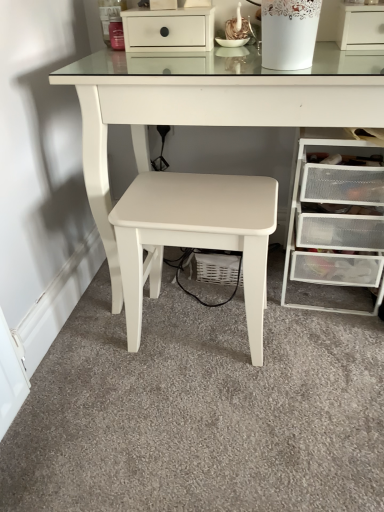
Question: Is clear plastic drawers at lower right, arranged as the first chest of drawers when ordered from the bottom, completely or partially outside of white matte drawer at upper center, positioned as the first chest of drawers in top-to-bottom order?

Choices:
 (A) yes
 (B) no

Answer: (A)

Question: Does clear plastic drawers at lower right, which appears as the 1th chest of drawers when viewed from the right, appear on the left side of white matte drawer at upper center, which ranks as the first chest of drawers in left-to-right order?

Choices:
 (A) yes
 (B) no

Answer: (B)

Question: From the image's perspective, is clear plastic drawers at lower right, which appears as the 1th chest of drawers when viewed from the right, on white matte drawer at upper center, which appears as the second chest of drawers when ordered from the bottom?

Choices:
 (A) yes
 (B) no

Answer: (B)

Question: Is clear plastic drawers at lower right, arranged as the first chest of drawers when ordered from the bottom, at the right side of white matte drawer at upper center, which ranks as the first chest of drawers in left-to-right order?

Choices:
 (A) no
 (B) yes

Answer: (B)

Question: Does clear plastic drawers at lower right, arranged as the first chest of drawers when ordered from the bottom, lie in front of white matte drawer at upper center, which ranks as the first chest of drawers in left-to-right order?

Choices:
 (A) no
 (B) yes

Answer: (B)

Question: Considering their positions, is clear plastic drawers at lower right, acting as the second chest of drawers starting from the left, located in front of or behind white matte stool at center?

Choices:
 (A) front
 (B) behind

Answer: (B)

Question: Does point (309, 194) appear closer or farther from the camera than point (261, 320)?

Choices:
 (A) farther
 (B) closer

Answer: (B)

Question: Considering the positions of clear plastic drawers at lower right, arranged as the first chest of drawers when ordered from the bottom, and white matte stool at center in the image, is clear plastic drawers at lower right, arranged as the first chest of drawers when ordered from the bottom, bigger or smaller than white matte stool at center?

Choices:
 (A) big
 (B) small

Answer: (A)

Question: Considering the positions of clear plastic drawers at lower right, acting as the second chest of drawers starting from the left, and white matte stool at center in the image, is clear plastic drawers at lower right, acting as the second chest of drawers starting from the left, wider or thinner than white matte stool at center?

Choices:
 (A) thin
 (B) wide

Answer: (B)

Question: Is point (317, 51) positioned closer to the camera than point (187, 46)?

Choices:
 (A) closer
 (B) farther

Answer: (B)

Question: Would you say white glossy table at center is to the left or to the right of white matte drawer at upper center, which ranks as the 2th chest of drawers in right-to-left order, in the picture?

Choices:
 (A) right
 (B) left

Answer: (A)

Question: Is white glossy table at center wider or thinner than white matte drawer at upper center, which appears as the second chest of drawers when ordered from the bottom?

Choices:
 (A) thin
 (B) wide

Answer: (B)

Question: From the image's perspective, is white glossy table at center above or below white matte drawer at upper center, which appears as the second chest of drawers when ordered from the bottom?

Choices:
 (A) above
 (B) below

Answer: (B)

Question: Is white glossy table at center situated inside clear plastic drawers at lower right, acting as the second chest of drawers starting from the left, or outside?

Choices:
 (A) outside
 (B) inside

Answer: (A)

Question: From their relative heights in the image, would you say white glossy table at center is taller or shorter than clear plastic drawers at lower right, which appears as the 1th chest of drawers when viewed from the right?

Choices:
 (A) tall
 (B) short

Answer: (A)